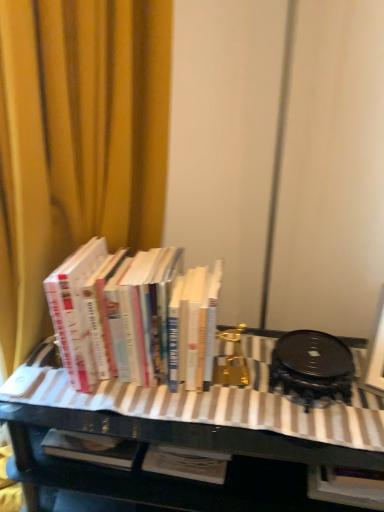
Image resolution: width=384 pixels, height=512 pixels. What are the coordinates of `free space above black glossy table at center (from a real-world perspective)` in the screenshot? It's located at point(231,393).